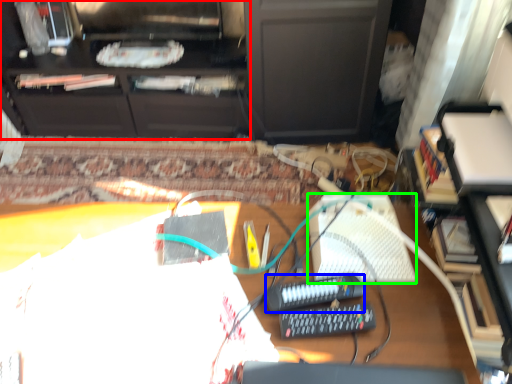
Question: Based on their relative distances, which object is farther from furniture (highlighted by a red box)? Choose from equipment (highlighted by a blue box) and keyboard (highlighted by a green box).

Choices:
 (A) equipment
 (B) keyboard

Answer: (A)